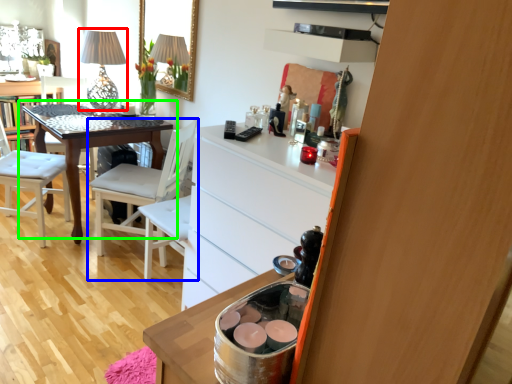
Question: Which object is positioned closest to table lamp (highlighted by a red box)? Select from chair (highlighted by a blue box) and table (highlighted by a green box).

Choices:
 (A) chair
 (B) table

Answer: (B)